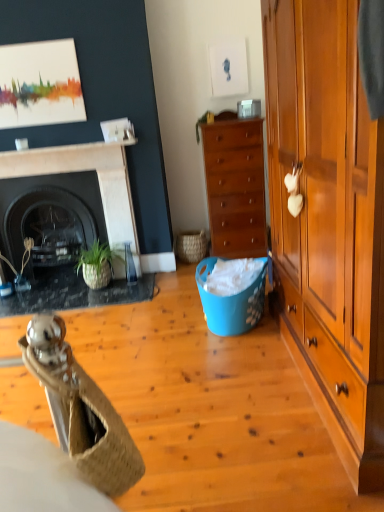
The height and width of the screenshot is (512, 384). In order to click on vacant space behind matte white coffee cup at upper left in this screenshot , I will do `click(27, 150)`.